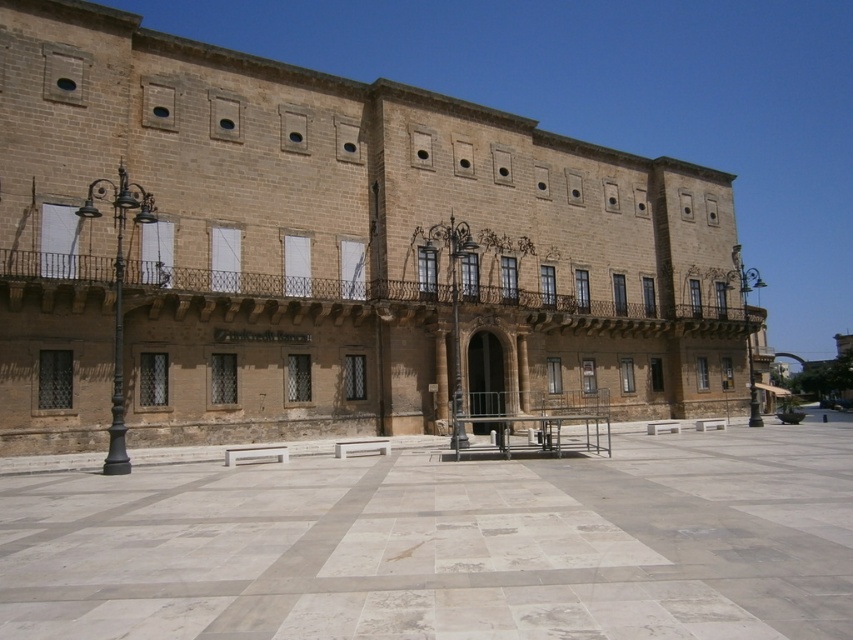
You are standing in the plaza in front of the historic building. You want to walk to the marble tiles at center. Which direction should you walk from your current position at point (331, 252)?

You are already at the marble tiles at center, as point (331, 252) corresponds to them.

You are a construction worker needing to know the height difference between the marble tiles at center and the matte stone square at upper left for a project. Based on the scene, which one is taller?

The marble tiles at center is taller than matte stone square at upper left according to the description.